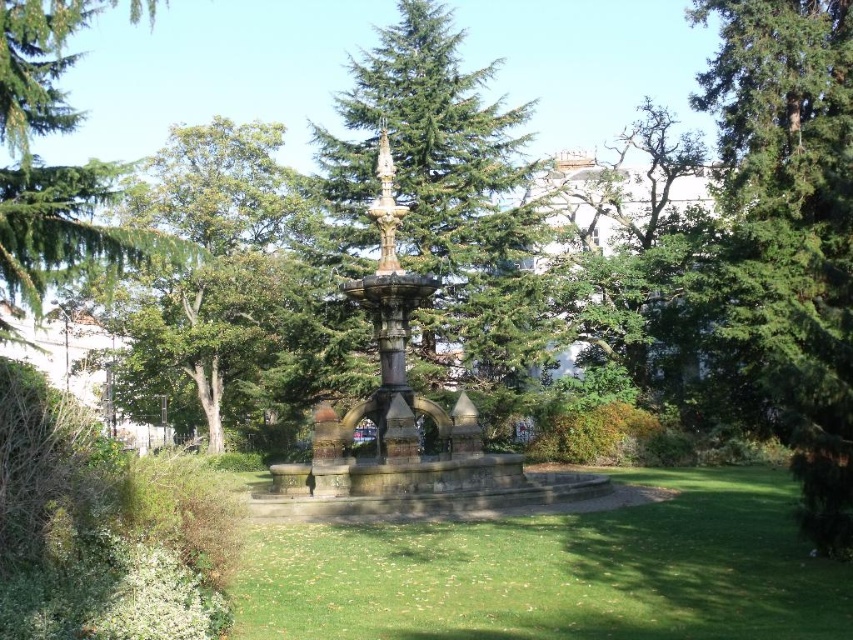
Question: Is green grass at center in front of green needle-like leaves at upper left?

Choices:
 (A) no
 (B) yes

Answer: (B)

Question: Does green textured tree at center come behind gold polished fountain at center?

Choices:
 (A) yes
 (B) no

Answer: (B)

Question: Does green leafy tree at center appear on the right side of gold polished fountain at center?

Choices:
 (A) yes
 (B) no

Answer: (B)

Question: Which point is farther to the camera?

Choices:
 (A) green textured tree at center
 (B) gold polished fountain at center
 (C) green grass at center
 (D) green needle-like leaves at upper left

Answer: (D)

Question: Estimate the real-world distances between objects in this image. Which object is farther from the green leafy tree at center?

Choices:
 (A) green needle-like leaves at upper left
 (B) gold polished fountain at center
 (C) green grass at center

Answer: (C)

Question: Which object is farther from the camera taking this photo?

Choices:
 (A) green needle-like leaves at upper left
 (B) green textured tree at center
 (C) gold polished fountain at center
 (D) green grass at center

Answer: (A)